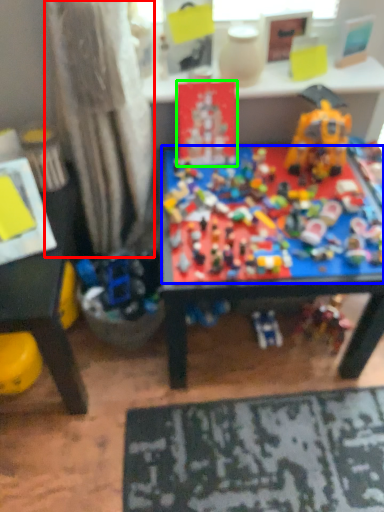
Question: Which is farther away from curtain (highlighted by a red box)? toy (highlighted by a blue box) or toy (highlighted by a green box)?

Choices:
 (A) toy
 (B) toy

Answer: (A)